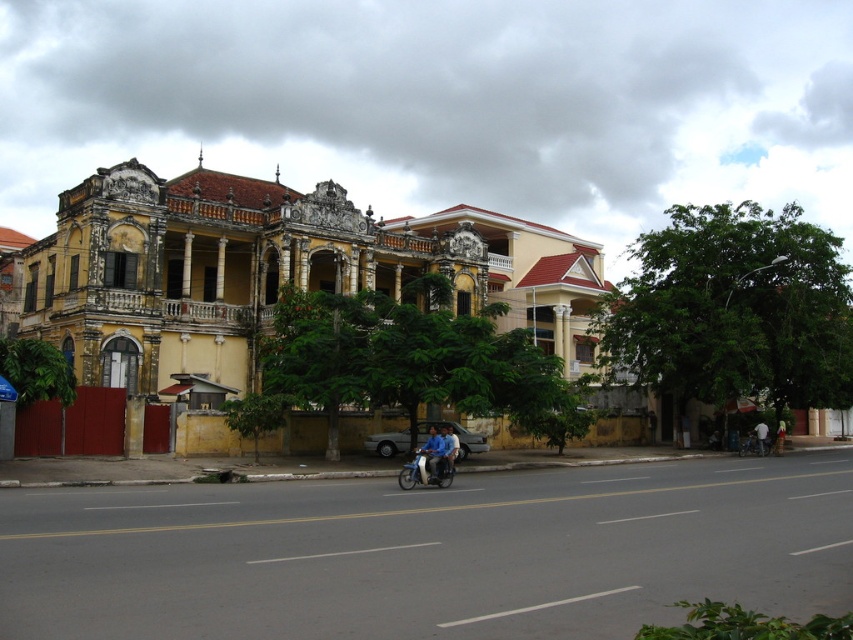
Can you confirm if blue metallic motorcycle at center is wider than metallic silver bicycle at lower right?

Indeed, blue metallic motorcycle at center has a greater width compared to metallic silver bicycle at lower right.

Between blue metallic motorcycle at center and metallic silver bicycle at lower right, which one appears on the right side from the viewer's perspective?

Positioned to the right is metallic silver bicycle at lower right.

Between point (401, 481) and point (752, 432), which one is positioned in front?

Point (401, 481)

Where is `blue metallic motorcycle at center`? Image resolution: width=853 pixels, height=640 pixels. blue metallic motorcycle at center is located at coordinates (425, 472).

Based on the photo, who is more distant from viewer, (432, 444) or (767, 442)?

The point (767, 442) is behind.

At what (x,y) coordinates should I click in order to perform the action: click on blue fabric shirt at center. Please return your answer as a coordinate pair (x, y). Image resolution: width=853 pixels, height=640 pixels. Looking at the image, I should click on (431, 456).

The width and height of the screenshot is (853, 640). What are the coordinates of `blue fabric shirt at center` in the screenshot? It's located at (431, 456).

Between metallic silver bicycle at lower right and light blue shirt at center, which one appears on the right side from the viewer's perspective?

Positioned to the right is light blue shirt at center.

What do you see at coordinates (752, 445) in the screenshot? The image size is (853, 640). I see `metallic silver bicycle at lower right` at bounding box center [752, 445].

Identify the location of metallic silver bicycle at lower right. This screenshot has height=640, width=853. (752, 445).